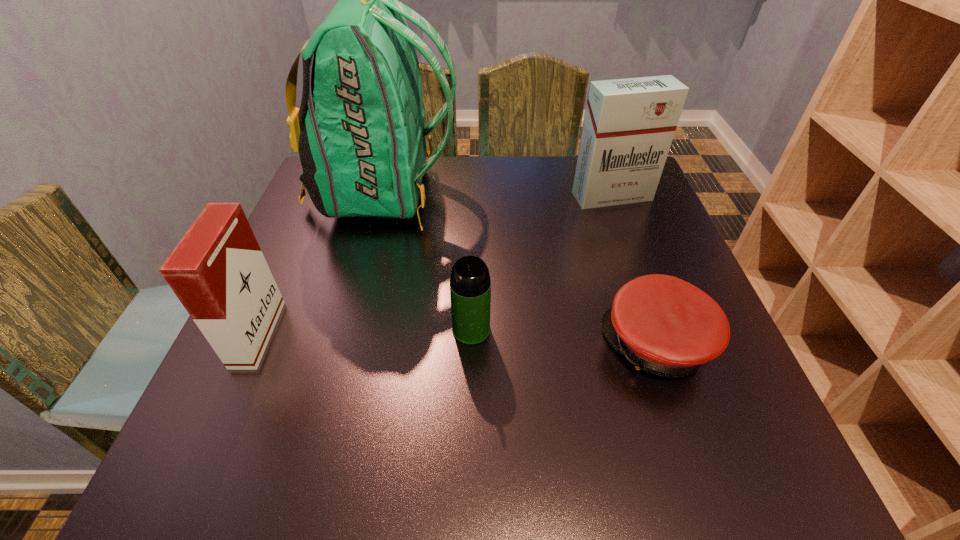
I want to click on cap that is positioned at the right edge, so click(x=664, y=325).

Where is `object that is at the far left corner`? object that is at the far left corner is located at coordinates (360, 134).

Find the location of `object that is at the far right corner`. object that is at the far right corner is located at coordinates (629, 124).

This screenshot has width=960, height=540. I want to click on free location at the far edge of the desktop, so click(x=502, y=188).

Image resolution: width=960 pixels, height=540 pixels. Find the location of `vacant space at the near edge`. vacant space at the near edge is located at coordinates (377, 483).

At what (x,y) coordinates should I click in order to perform the action: click on vacant area at the left edge of the desktop. Please return your answer as a coordinate pair (x, y). Looking at the image, I should click on [x=349, y=231].

At what (x,y) coordinates should I click in order to perform the action: click on vacant space at the right edge of the desktop. Please return your answer as a coordinate pair (x, y). This screenshot has width=960, height=540. Looking at the image, I should click on (661, 210).

Locate an element on the screen. free spot between the taller cigarette_case and the thermos bottle is located at coordinates (541, 263).

Find the location of a particular element. The width and height of the screenshot is (960, 540). vacant area that lies between the right cigarette_case and the shorter cigarette_case is located at coordinates (435, 265).

The width and height of the screenshot is (960, 540). In order to click on free space that is in between the left cigarette_case and the third object from right to left in this screenshot , I will do `click(365, 332)`.